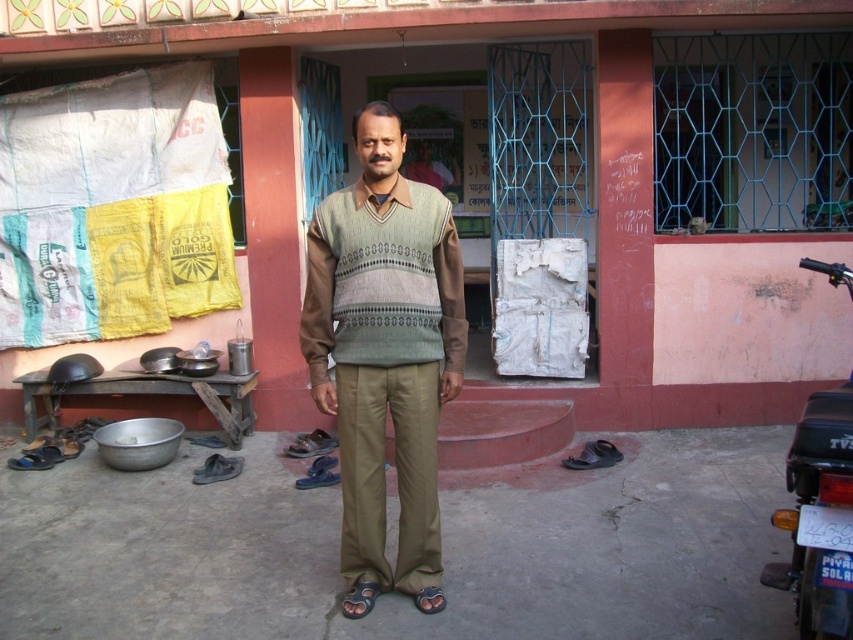
Is point (379, 273) positioned in front of point (822, 394)?

No, (379, 273) is behind (822, 394).

Does knitted beige sweater at center have a lesser height compared to black matte motorcycle at right?

Correct, knitted beige sweater at center is not as tall as black matte motorcycle at right.

Between point (445, 336) and point (817, 508), which one is positioned behind?

Positioned behind is point (445, 336).

In order to click on knitted beige sweater at center in this screenshot , I will do `click(381, 282)`.

Locate an element on the screen. Image resolution: width=853 pixels, height=640 pixels. knitted sweater at center is located at coordinates (384, 355).

Which is below, knitted sweater at center or black matte motorcycle at right?

black matte motorcycle at right is below.

Does point (433, 486) come closer to viewer compared to point (842, 412)?

No, it is not.

Where is `knitted sweater at center`? knitted sweater at center is located at coordinates (384, 355).

Between point (344, 483) and point (326, 301), which one is positioned in front?

Positioned in front is point (326, 301).

Is knitted sweater at center shorter than knitted beige sweater at center?

No.

Is point (312, 380) behind point (424, 250)?

Yes, it is behind point (424, 250).

I want to click on knitted sweater at center, so click(x=384, y=355).